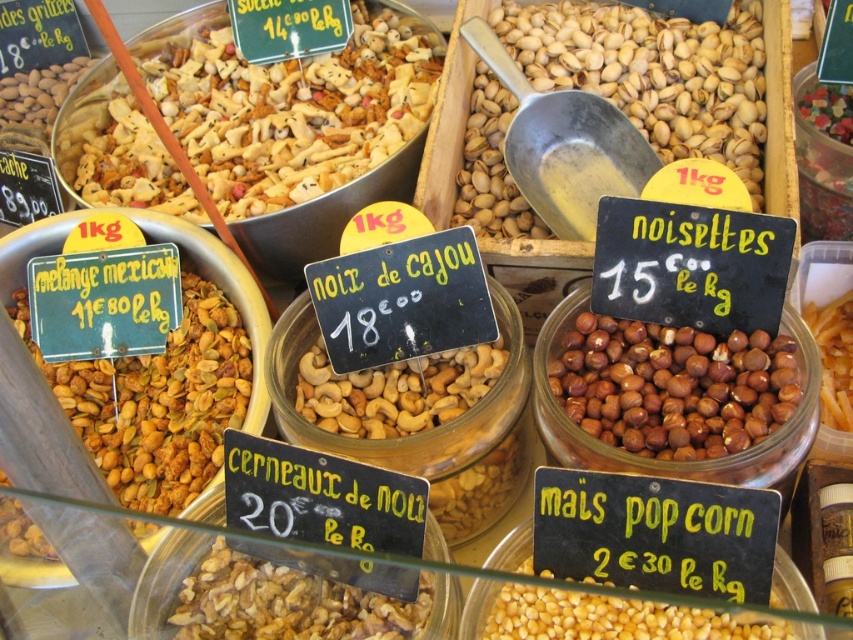
Question: Where is brown matte mix at left located in relation to pistachio nuts at center in the image?

Choices:
 (A) left
 (B) right

Answer: (A)

Question: Does shiny metallic nuts at upper left come in front of pistachio nuts at center?

Choices:
 (A) yes
 (B) no

Answer: (B)

Question: Which point is farther from the camera taking this photo?

Choices:
 (A) (518, 129)
 (B) (6, 500)
 (C) (577, 604)
 (D) (338, 138)

Answer: (D)

Question: Is pistachio nuts at center positioned in front of yellow matte popcorn at lower center?

Choices:
 (A) no
 (B) yes

Answer: (A)

Question: Among these points, which one is farthest from the camera?

Choices:
 (A) (598, 614)
 (B) (370, 140)
 (C) (602, 161)
 (D) (193, 330)

Answer: (B)

Question: Which object is closer to the camera taking this photo?

Choices:
 (A) brown matte hazelnuts at center
 (B) pistachio nuts at center
 (C) brown crunchy nuts at center

Answer: (C)